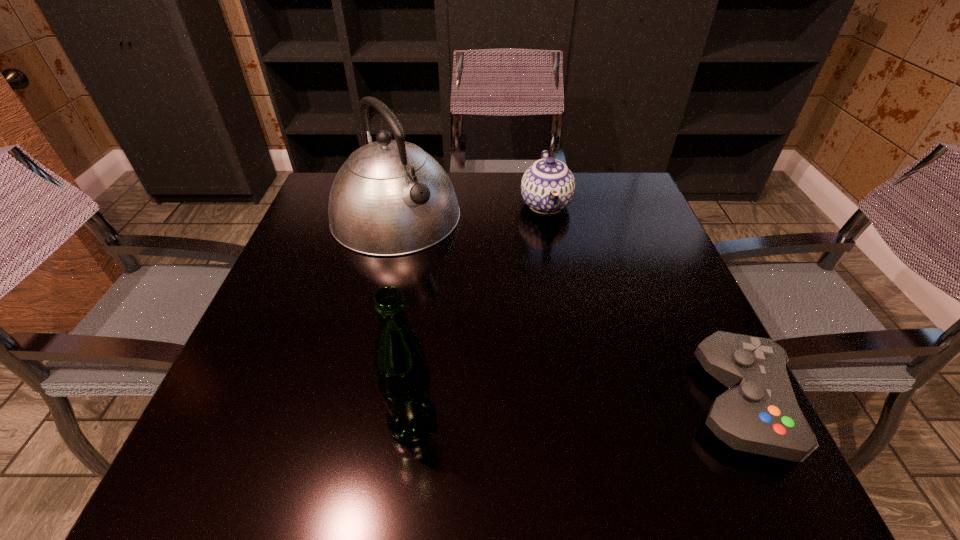
At what (x,y) coordinates should I click in order to perform the action: click on free space located at the spout of the second shortest object. Please return your answer as a coordinate pair (x, y). This screenshot has width=960, height=540. Looking at the image, I should click on (564, 293).

You are a GUI agent. You are given a task and a screenshot of the screen. Output one action in this format:
    pyautogui.click(x=<x>, y=<y>)
    Task: Click on the free space located 0.210m from the spout of the kettle
    
    Given the screenshot: What is the action you would take?
    point(474,302)

The height and width of the screenshot is (540, 960). I want to click on vacant space located 0.230m from the spout of the kettle, so click(479, 308).

Identify the location of free space located 0.170m from the spout of the kettle. (464, 292).

Where is `chinaware located in the far edge section of the desktop`? This screenshot has width=960, height=540. chinaware located in the far edge section of the desktop is located at coordinates (548, 186).

The image size is (960, 540). I want to click on kettle at the far edge, so click(390, 198).

The height and width of the screenshot is (540, 960). In order to click on beer bottle at the near edge in this screenshot , I will do `click(403, 377)`.

Image resolution: width=960 pixels, height=540 pixels. In order to click on control at the near edge in this screenshot , I will do `click(759, 413)`.

What are the coordinates of `object that is at the left edge` in the screenshot? It's located at (390, 198).

Where is `object positioned at the right edge`? object positioned at the right edge is located at coordinates (759, 413).